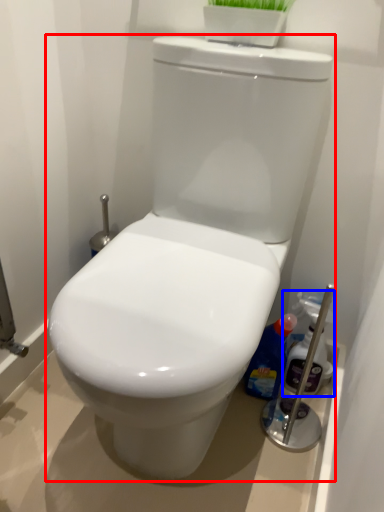
Question: Which object appears closest to the camera in this image, toilet (highlighted by a red box) or cleaning product (highlighted by a blue box)?

Choices:
 (A) toilet
 (B) cleaning product

Answer: (A)